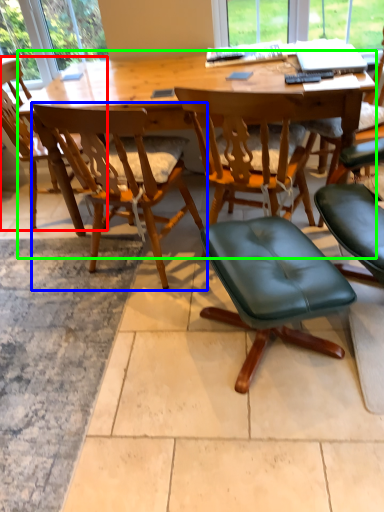
Question: Considering the real-world distances, which object is farthest from chair (highlighted by a red box)? chair (highlighted by a blue box) or desk (highlighted by a green box)?

Choices:
 (A) chair
 (B) desk

Answer: (A)